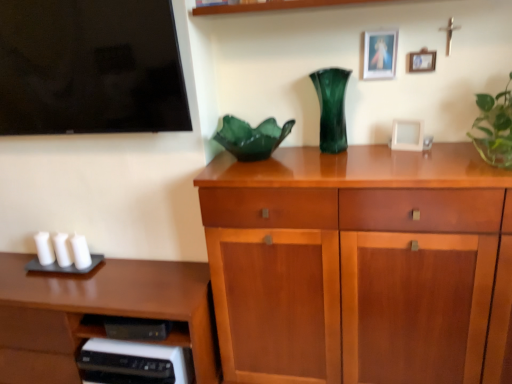
Image resolution: width=512 pixels, height=384 pixels. I want to click on vacant area on top of brown wood desk at lower left (from a real-world perspective), so click(x=74, y=265).